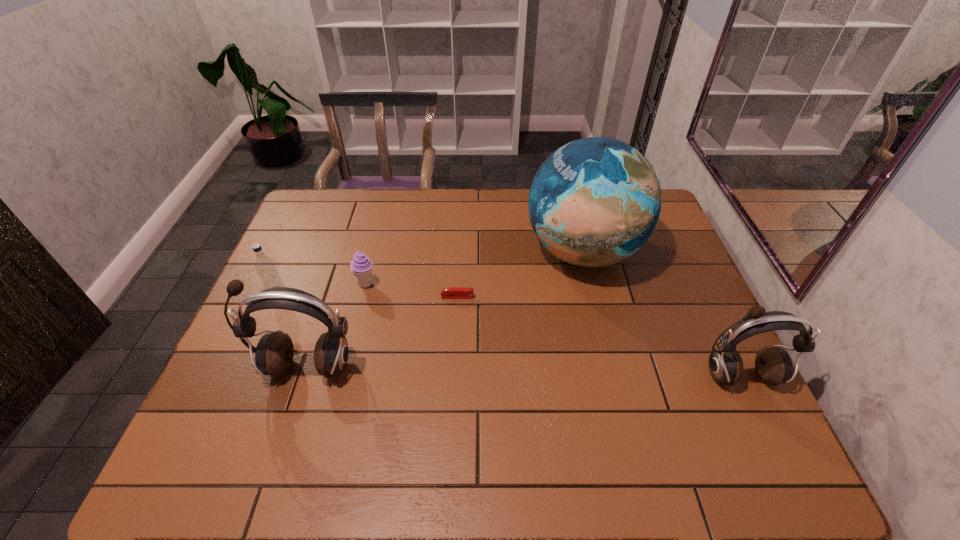
Identify the location of earphone located at the right edge. This screenshot has width=960, height=540. (774, 366).

You are a GUI agent. You are given a task and a screenshot of the screen. Output one action in this format:
    pyautogui.click(x=<x>, y=<y>)
    Task: Click on the globe located in the right edge section of the desktop
    
    Given the screenshot: What is the action you would take?
    pyautogui.click(x=595, y=201)

Find the location of a particular element. object at the far right corner is located at coordinates (595, 201).

At what (x,y) coordinates should I click in order to perform the action: click on object located in the near right corner section of the desktop. Please return your answer as a coordinate pair (x, y). This screenshot has width=960, height=540. Looking at the image, I should click on (774, 366).

Find the location of `vacant space at the far edge of the desktop`. vacant space at the far edge of the desktop is located at coordinates (524, 203).

In the image, there is a desktop. Where is `blank space at the near edge`? This screenshot has width=960, height=540. blank space at the near edge is located at coordinates (612, 417).

In the image, there is a desktop. Identify the location of vacant space at the right edge. (637, 285).

In order to click on vacant region at the far left corner of the desktop in this screenshot , I will do `click(339, 205)`.

The height and width of the screenshot is (540, 960). In order to click on free space between the third shortest object and the icecream in this screenshot , I will do `click(323, 289)`.

Find the location of `vacant space that is in between the globe and the shorter earphone`. vacant space that is in between the globe and the shorter earphone is located at coordinates (660, 314).